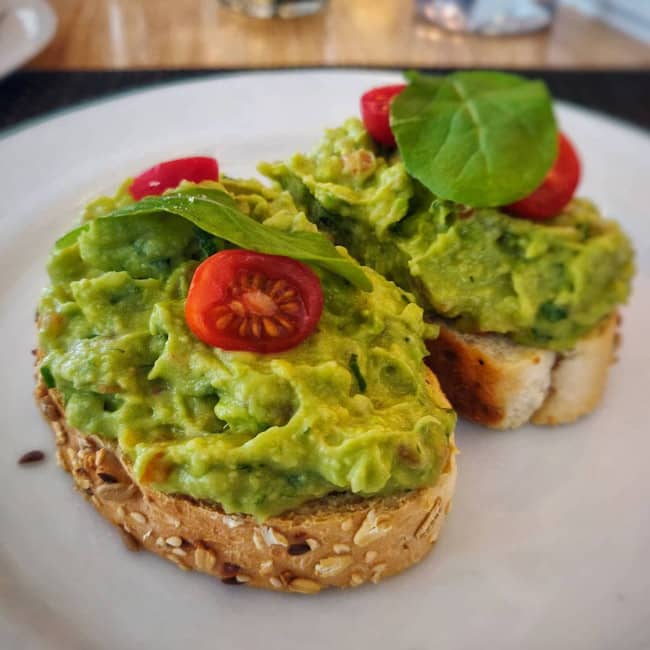
This screenshot has height=650, width=650. Identify the location of edge of plate. (36, 32).